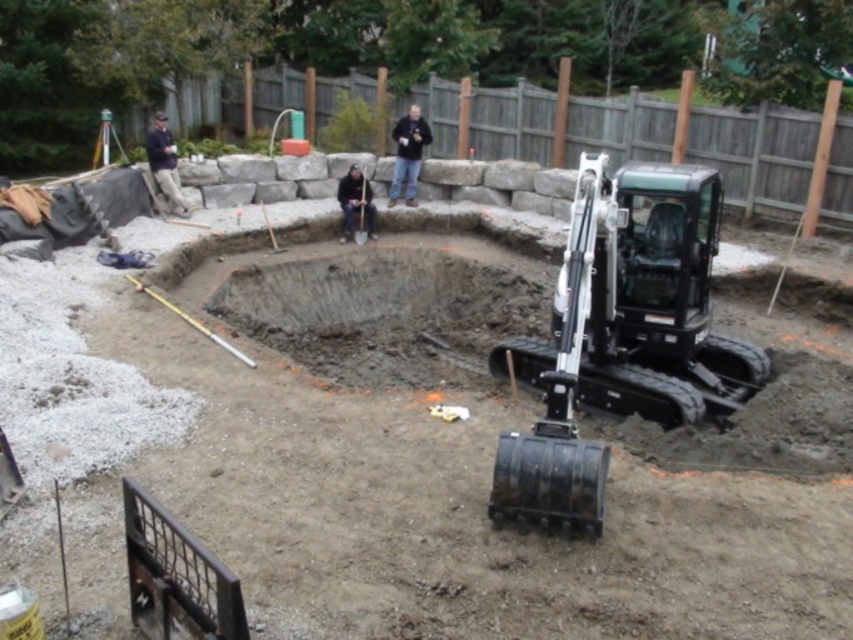
Who is more distant from viewer, [711,333] or [404,145]?

Positioned behind is point [404,145].

Between black rubber excavator at lower right and black matte jacket at center, which one is positioned higher?

Positioned higher is black matte jacket at center.

Which is in front, point (666, 288) or point (399, 177)?

Point (666, 288)

The height and width of the screenshot is (640, 853). Identify the location of black rubber excavator at lower right. (619, 337).

Which is in front, point (419, 160) or point (161, 132)?

Point (161, 132) is in front.

Can you confirm if black matte jacket at center is wider than dark blue shirt at upper left?

Correct, the width of black matte jacket at center exceeds that of dark blue shirt at upper left.

Is point (415, 166) in front of point (164, 154)?

That is False.

Locate an element on the screen. The width and height of the screenshot is (853, 640). black matte jacket at center is located at coordinates point(408,154).

Between point (148, 138) and point (346, 230), which one is positioned in front?

Point (148, 138)

Is point (154, 161) less distant than point (349, 179)?

Yes, point (154, 161) is in front of point (349, 179).

Where is `dark blue shirt at upper left`? dark blue shirt at upper left is located at coordinates (165, 163).